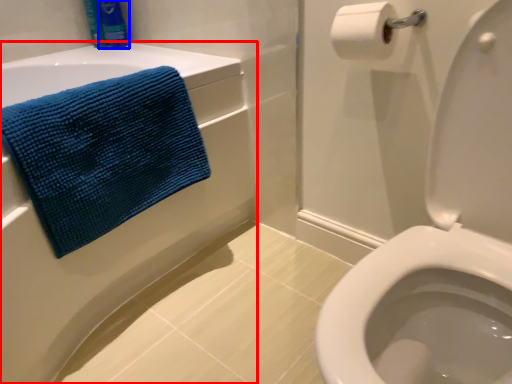
Question: Which object appears closest to the camera in this image, bath (highlighted by a red box) or toiletry (highlighted by a blue box)?

Choices:
 (A) bath
 (B) toiletry

Answer: (A)